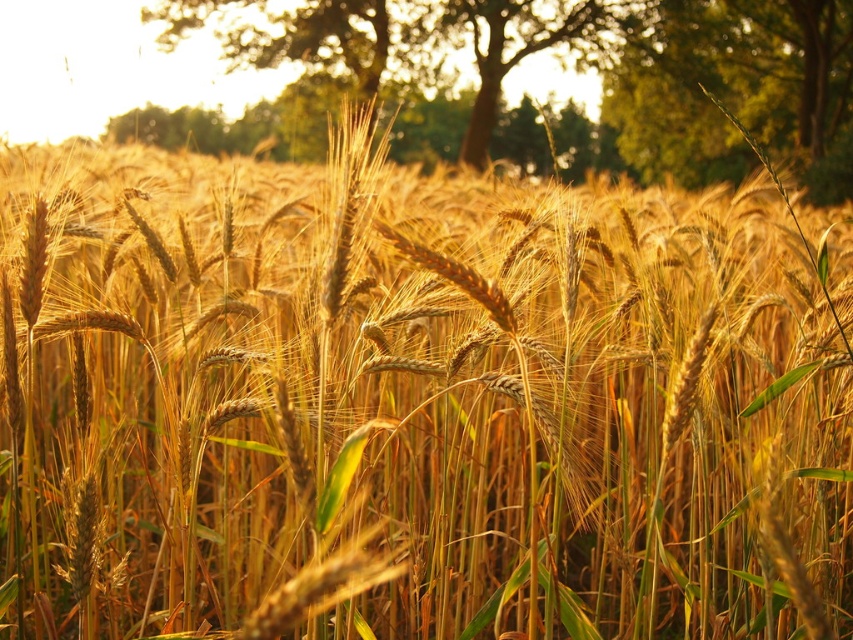
You are standing in the wheat field and want to find the tallest tree to climb for a better view. Which tree should you choose between the green leafy tree at upper center and the green leafy tree at upper right?

The green leafy tree at upper center is much taller than the green leafy tree at upper right, so you should choose the green leafy tree at upper center to climb for a better view.